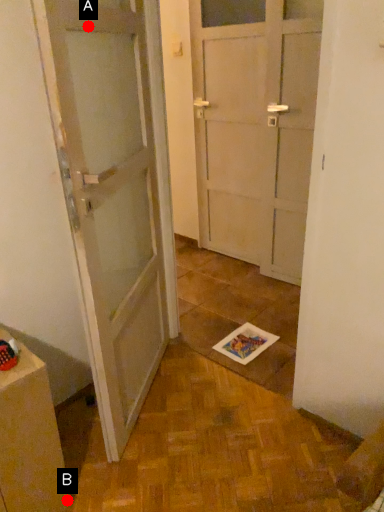
Question: Two points are circled on the image, labeled by A and B beside each circle. Which point is farther from the camera taking this photo?

Choices:
 (A) A is further
 (B) B is further

Answer: (B)